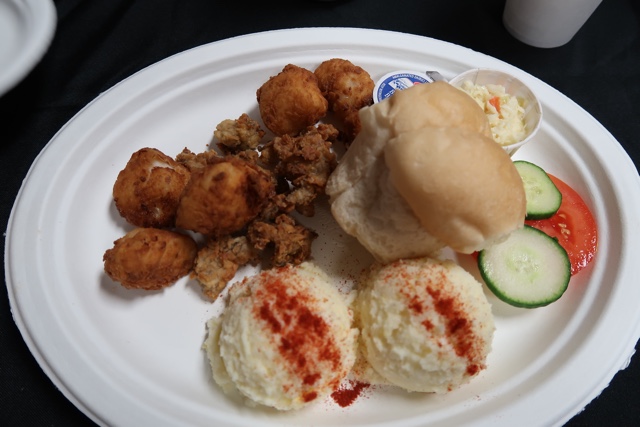
I want to click on empty space to the right of plate, so click(x=633, y=150).